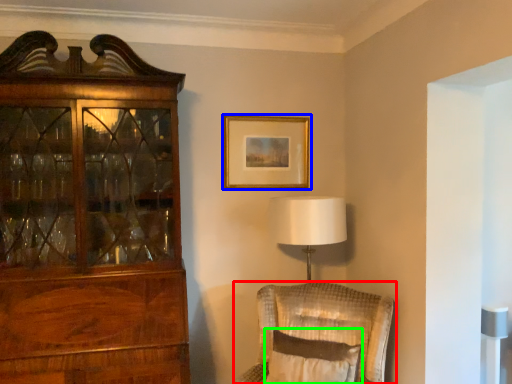
Question: Based on their relative distances, which object is nearer to chair (highlighted by a red box)? Choose from picture frame (highlighted by a blue box) and pillow (highlighted by a green box).

Choices:
 (A) picture frame
 (B) pillow

Answer: (B)